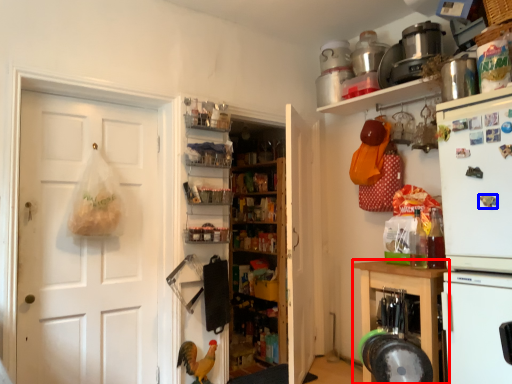
Question: Which object is closer to the camera taking this photo, cabinetry (highlighted by a red box) or magnet (highlighted by a blue box)?

Choices:
 (A) cabinetry
 (B) magnet

Answer: (B)